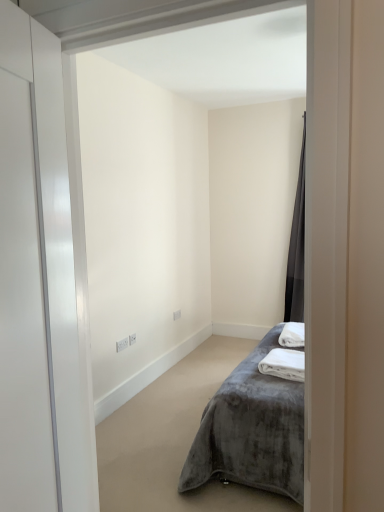
In order to click on white soft towel at lower right, the 1th bath towel from the front in this screenshot , I will do `click(284, 364)`.

Describe the element at coordinates (292, 335) in the screenshot. The image size is (384, 512). I see `white plush bath towel at lower right, the 2th bath towel positioned from the front` at that location.

In order to face white glossy door at left, should I rotate leftwards or rightwards?

You should rotate left by 21.716 degrees.

Locate an element on the screen. Image resolution: width=384 pixels, height=512 pixels. dark gray velvet curtain at right is located at coordinates (297, 248).

You are a GUI agent. You are given a task and a screenshot of the screen. Output one action in this format:
    pyautogui.click(x=<x>, y=<y>)
    Task: Click on the 1st bath towel to the right when counting from the velvet grey bed at center
    The image size is (384, 512).
    Given the screenshot: What is the action you would take?
    pyautogui.click(x=284, y=364)

Does white soft towel at lower right, positioned as the second bath towel in back-to-front order, come in front of velvet grey bed at center?

No, it is not.

Which is more to the left, white soft towel at lower right, the 1th bath towel from the front, or velvet grey bed at center?

From the viewer's perspective, velvet grey bed at center appears more on the left side.

From the image's perspective, does white glossy door at left appear lower than white soft towel at lower right, the 1th bath towel from the front?

No, from the image's perspective, white glossy door at left is not below white soft towel at lower right, the 1th bath towel from the front.

Does white glossy door at left touch white soft towel at lower right, the 1th bath towel from the front?

No, white glossy door at left is not in contact with white soft towel at lower right, the 1th bath towel from the front.

Identify the location of the 1st bath towel counting from the right of the white glossy door at left. The height and width of the screenshot is (512, 384). (284, 364).

Is point (11, 118) closer to camera compared to point (296, 372)?

Yes, it is.

Which is closer, [300,172] or [41,72]?

Positioned in front is point [41,72].

Consider the image. Is dark gray velvet curtain at right positioned far away from white glossy door at left?

Absolutely, dark gray velvet curtain at right is distant from white glossy door at left.

Is dark gray velvet curtain at right bigger or smaller than white glossy door at left?

In the image, dark gray velvet curtain at right appears to be larger than white glossy door at left.

In terms of height, does dark gray velvet curtain at right look taller or shorter compared to white glossy door at left?

dark gray velvet curtain at right is taller than white glossy door at left.

From the image's perspective, relative to velvet grey bed at center, is white glossy door at left above or below?

white glossy door at left is above velvet grey bed at center.

Could velvet grey bed at center be considered to be inside white glossy door at left?

Definitely not — velvet grey bed at center is not inside white glossy door at left.

You are a GUI agent. You are given a task and a screenshot of the screen. Output one action in this format:
    pyautogui.click(x=<x>, y=<y>)
    Task: Click on the bed that is under the white glossy door at left (from a real-world perspective)
    This screenshot has width=384, height=512.
    Given the screenshot: What is the action you would take?
    pyautogui.click(x=251, y=431)

Who is shorter, white glossy door at left or velvet grey bed at center?

Standing shorter between the two is velvet grey bed at center.

You are a GUI agent. You are given a task and a screenshot of the screen. Output one action in this format:
    pyautogui.click(x=<x>, y=<y>)
    Task: Click on the bath towel that is the 1st one when counting forward from the dark gray velvet curtain at right
    The image size is (384, 512).
    Given the screenshot: What is the action you would take?
    pyautogui.click(x=292, y=335)

From a real-world perspective, which is physically above, white plush bath towel at lower right, the first bath towel positioned from the back, or dark gray velvet curtain at right?

dark gray velvet curtain at right is physically above.

From the image's perspective, is white plush bath towel at lower right, the 2th bath towel positioned from the front, on top of dark gray velvet curtain at right?

No.

Who is shorter, white plush bath towel at lower right, the first bath towel positioned from the back, or dark gray velvet curtain at right?

white plush bath towel at lower right, the first bath towel positioned from the back, is shorter.

Is dark gray velvet curtain at right not inside white soft towel at lower right, positioned as the second bath towel in back-to-front order?

Absolutely, dark gray velvet curtain at right is external to white soft towel at lower right, positioned as the second bath towel in back-to-front order.

Considering the relative sizes of dark gray velvet curtain at right and white soft towel at lower right, the 1th bath towel from the front, in the image provided, is dark gray velvet curtain at right bigger than white soft towel at lower right, the 1th bath towel from the front,?

Correct, dark gray velvet curtain at right is larger in size than white soft towel at lower right, the 1th bath towel from the front.

Considering the relative sizes of dark gray velvet curtain at right and white soft towel at lower right, positioned as the second bath towel in back-to-front order, in the image provided, is dark gray velvet curtain at right taller than white soft towel at lower right, positioned as the second bath towel in back-to-front order,?

Yes, dark gray velvet curtain at right is taller than white soft towel at lower right, positioned as the second bath towel in back-to-front order.

Which object is thinner, white soft towel at lower right, positioned as the second bath towel in back-to-front order, or white plush bath towel at lower right, the 2th bath towel positioned from the front?

white plush bath towel at lower right, the 2th bath towel positioned from the front, is thinner.

Identify the location of bath towel located on the right of white soft towel at lower right, positioned as the second bath towel in back-to-front order. (292, 335).

Consider the image. Is white soft towel at lower right, the 1th bath towel from the front, situated inside white plush bath towel at lower right, the 2th bath towel positioned from the front, or outside?

white soft towel at lower right, the 1th bath towel from the front, is outside white plush bath towel at lower right, the 2th bath towel positioned from the front.

Find the location of a particular element. This screenshot has height=512, width=384. bath towel that is the 1st one above the velvet grey bed at center (from a real-world perspective) is located at coordinates (284, 364).

Image resolution: width=384 pixels, height=512 pixels. Find the location of `the 1st bath towel to the right when counting from the white glossy door at left`. the 1st bath towel to the right when counting from the white glossy door at left is located at coordinates (284, 364).

When comparing their distances from white glossy door at left, does dark gray velvet curtain at right or velvet grey bed at center seem closer?

velvet grey bed at center is closer to white glossy door at left.

Based on their spatial positions, is white plush bath towel at lower right, the 2th bath towel positioned from the front, or velvet grey bed at center further from white soft towel at lower right, the 1th bath towel from the front?

The object further to white soft towel at lower right, the 1th bath towel from the front, is velvet grey bed at center.

From the image, which object appears to be nearer to dark gray velvet curtain at right, white plush bath towel at lower right, the first bath towel positioned from the back, or white soft towel at lower right, the 1th bath towel from the front?

Based on the image, white plush bath towel at lower right, the first bath towel positioned from the back, appears to be nearer to dark gray velvet curtain at right.

Looking at the image, which one is located closer to white glossy door at left, white soft towel at lower right, the 1th bath towel from the front, or white plush bath towel at lower right, the 2th bath towel positioned from the front?

white soft towel at lower right, the 1th bath towel from the front, lies closer to white glossy door at left than the other object.

Considering their positions, is dark gray velvet curtain at right positioned closer to white plush bath towel at lower right, the first bath towel positioned from the back, than white soft towel at lower right, positioned as the second bath towel in back-to-front order?

The object closer to white plush bath towel at lower right, the first bath towel positioned from the back, is white soft towel at lower right, positioned as the second bath towel in back-to-front order.

Estimate the real-world distances between objects in this image. Which object is closer to white soft towel at lower right, the 1th bath towel from the front, velvet grey bed at center or white plush bath towel at lower right, the 2th bath towel positioned from the front?

white plush bath towel at lower right, the 2th bath towel positioned from the front, is closer to white soft towel at lower right, the 1th bath towel from the front.

Looking at the image, which one is located further to white glossy door at left, white plush bath towel at lower right, the first bath towel positioned from the back, or white soft towel at lower right, the 1th bath towel from the front?

Among the two, white plush bath towel at lower right, the first bath towel positioned from the back, is located further to white glossy door at left.

Which object lies nearer to the anchor point white glossy door at left, velvet grey bed at center or white plush bath towel at lower right, the 2th bath towel positioned from the front?

velvet grey bed at center is positioned closer to the anchor white glossy door at left.

At what (x,y) coordinates should I click in order to perform the action: click on bath towel positioned between velvet grey bed at center and white plush bath towel at lower right, the 2th bath towel positioned from the front, from near to far. Please return your answer as a coordinate pair (x, y). Image resolution: width=384 pixels, height=512 pixels. Looking at the image, I should click on tap(284, 364).

Locate an element on the screen. The width and height of the screenshot is (384, 512). bath towel between white soft towel at lower right, positioned as the second bath towel in back-to-front order, and dark gray velvet curtain at right, along the z-axis is located at coordinates (292, 335).

Locate an element on the screen. bed located between white glossy door at left and white plush bath towel at lower right, the first bath towel positioned from the back, in the depth direction is located at coordinates (251, 431).

Where is `bath towel located between white glossy door at left and white plush bath towel at lower right, the 2th bath towel positioned from the front, in the depth direction`? The width and height of the screenshot is (384, 512). bath towel located between white glossy door at left and white plush bath towel at lower right, the 2th bath towel positioned from the front, in the depth direction is located at coordinates (284, 364).